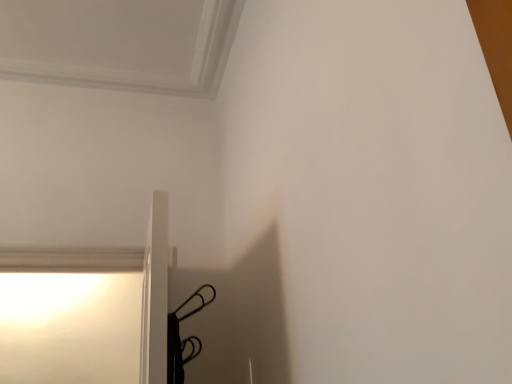
Describe the element at coordinates (182, 340) in the screenshot. I see `black matte hanger at upper left` at that location.

Identify the location of black matte hanger at upper left. The width and height of the screenshot is (512, 384). (182, 340).

Find the location of a particular element. This screenshot has height=384, width=512. black matte hanger at upper left is located at coordinates (182, 340).